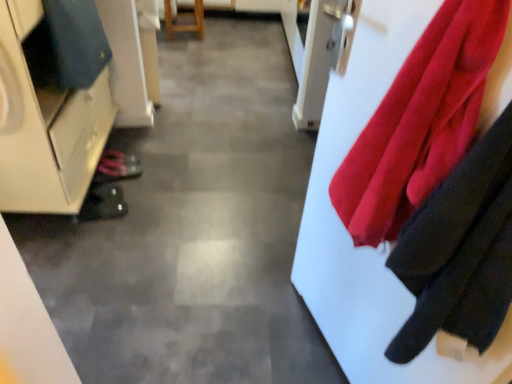
Locate an element on the screen. The image size is (512, 384). spots to the right of black rubber shoe at lower left, which is the first shoe from front to back is located at coordinates (140, 215).